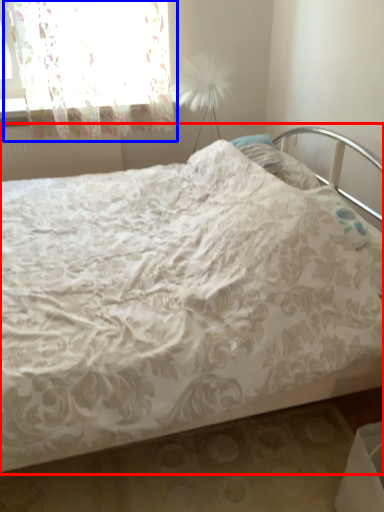
Question: Which point is further to the camera, bed (highlighted by a red box) or curtain (highlighted by a blue box)?

Choices:
 (A) bed
 (B) curtain

Answer: (B)